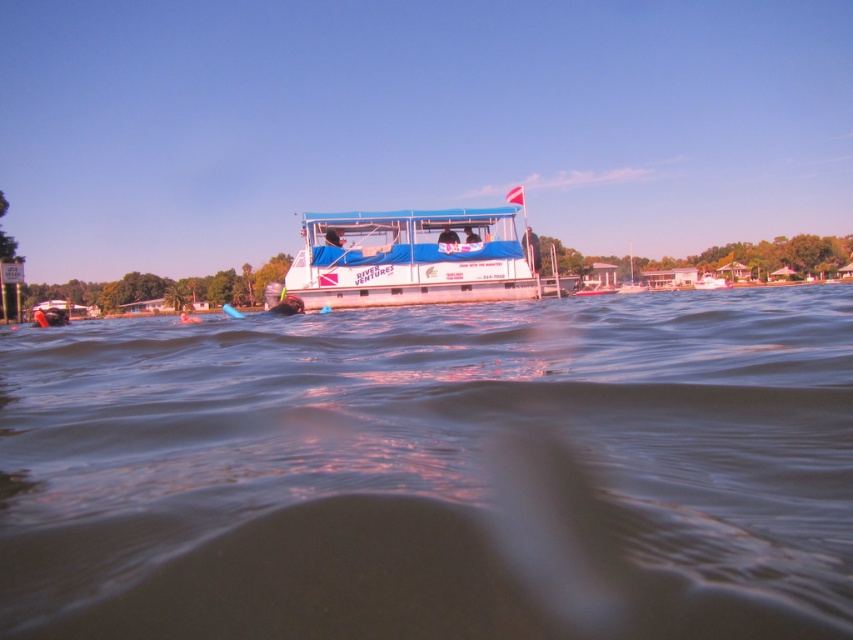
You are a photographer planning to take a photo of the blue rubber ring at upper center. The camera you are using has a focal length of 50mm. To ensure the ring is in the center of the photo, where should you position the camera relative to the scene?

The blue rubber ring at upper center is located at coordinates point (447,236). To center it in the photo with a 50mm lens, position the camera so the ring aligns with the center of the viewfinder, which corresponds to the coordinates provided.

You are a swimmer who wants to dive into the water. You see the clear water at center and the matte black wetsuit at center. Which object is larger in size?

The clear water at center is bigger than the matte black wetsuit at center.